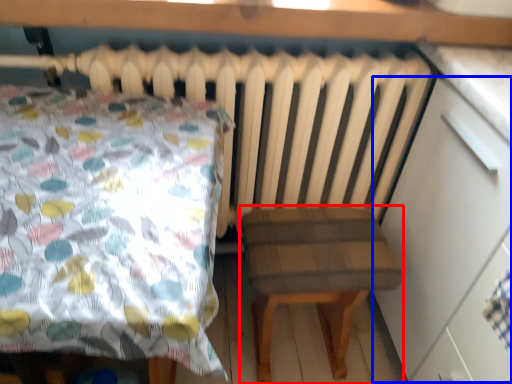
Question: Among these objects, which one is farthest to the camera, stool (highlighted by a red box) or dresser (highlighted by a blue box)?

Choices:
 (A) stool
 (B) dresser

Answer: (A)